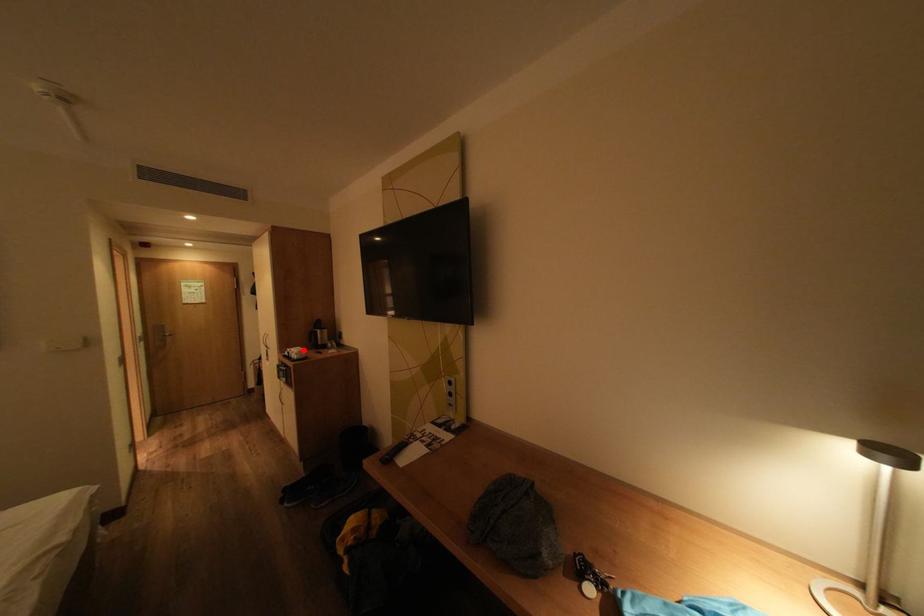
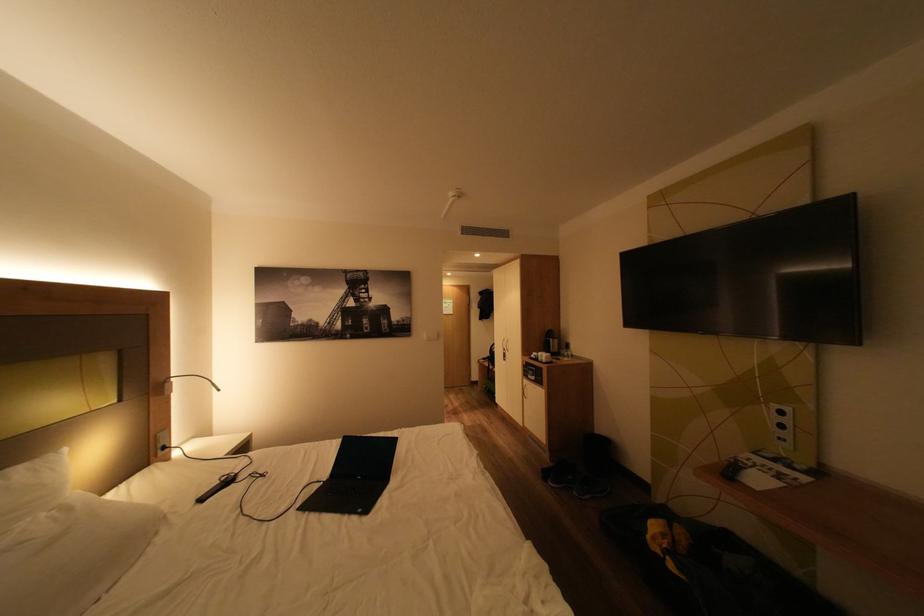
Question: I am providing you with two images of the same scene from different viewpoints. A red point is marked on the first image. Is the red point's position out of view in image 2?

Choices:
 (A) Yes
 (B) No

Answer: (B)